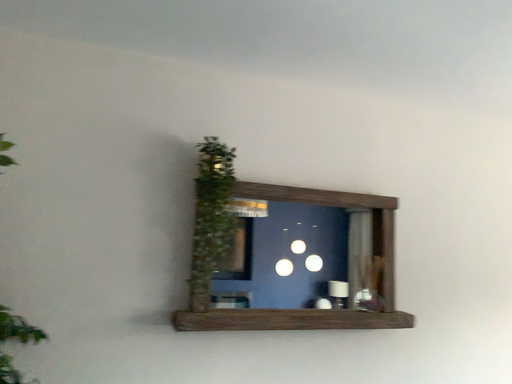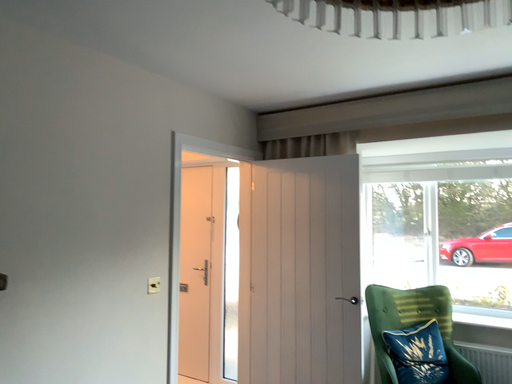
Question: Which way did the camera rotate in the video?

Choices:
 (A) rotated right
 (B) rotated left

Answer: (A)